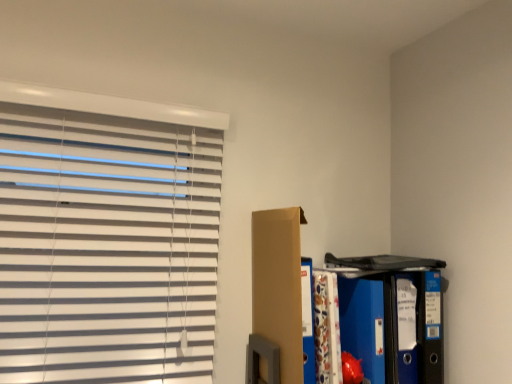
The height and width of the screenshot is (384, 512). What do you see at coordinates (280, 300) in the screenshot? I see `brown cardboard box at center-right` at bounding box center [280, 300].

Identify the location of brown cardboard box at center-right. The height and width of the screenshot is (384, 512). (280, 300).

Image resolution: width=512 pixels, height=384 pixels. What are the coordinates of `brown cardboard box at center-right` in the screenshot? It's located at (280, 300).